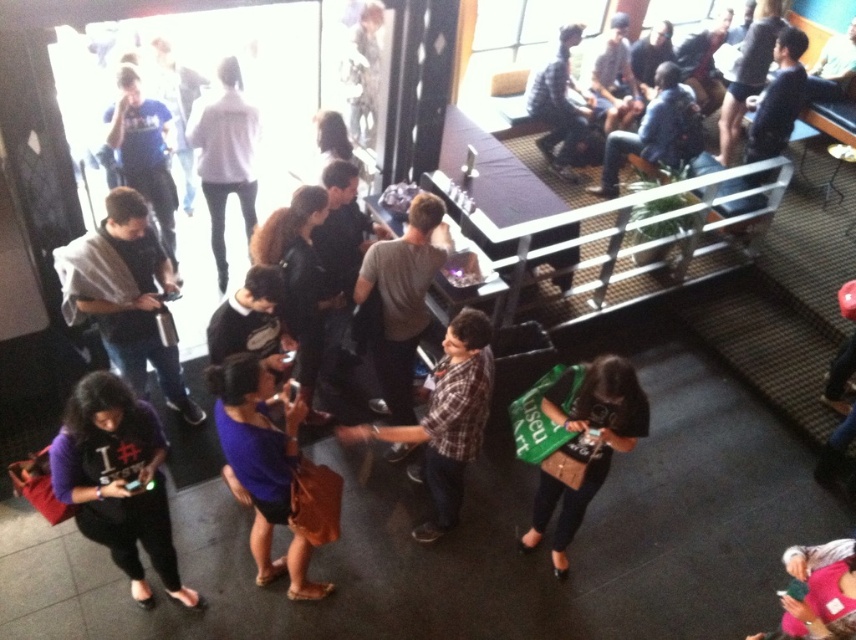
Between matte black shirt at left and plaid shirt at upper center, which one appears on the left side from the viewer's perspective?

Positioned to the left is matte black shirt at left.

What do you see at coordinates (143, 152) in the screenshot? The image size is (856, 640). I see `matte black shirt at left` at bounding box center [143, 152].

This screenshot has height=640, width=856. What are the coordinates of `matte black shirt at left` in the screenshot? It's located at (143, 152).

Does point (288, 476) lie behind point (462, 417)?

No, (288, 476) is in front of (462, 417).

Is purple fabric shirt at center wider than plaid shirt at center?

Incorrect, purple fabric shirt at center's width does not surpass plaid shirt at center's.

Does point (293, 435) come closer to viewer compared to point (415, 428)?

Yes, it is in front of point (415, 428).

Locate an element on the screen. purple fabric shirt at center is located at coordinates (272, 472).

What are the coordinates of `dark gray sweater at center` in the screenshot? It's located at (128, 298).

Does dark gray sweater at center appear on the left side of plaid shirt at upper center?

Indeed, dark gray sweater at center is positioned on the left side of plaid shirt at upper center.

At what (x,y) coordinates should I click in order to perform the action: click on dark gray sweater at center. Please return your answer as a coordinate pair (x, y). The width and height of the screenshot is (856, 640). Looking at the image, I should click on (128, 298).

Locate an element on the screen. This screenshot has height=640, width=856. dark gray sweater at center is located at coordinates coord(128,298).